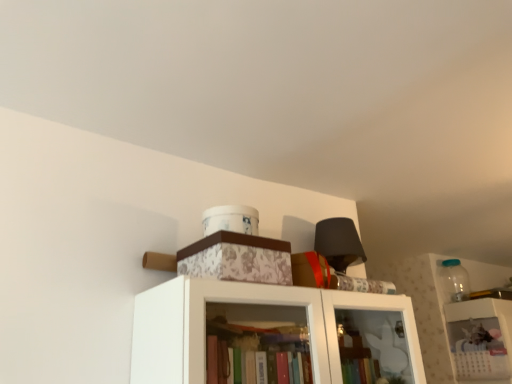
Question: Is white paper calendar at upper right with floral-patterned cardboard box at upper center?

Choices:
 (A) no
 (B) yes

Answer: (A)

Question: Considering the relative sizes of white paper calendar at upper right and floral-patterned cardboard box at upper center in the image provided, is white paper calendar at upper right wider than floral-patterned cardboard box at upper center?

Choices:
 (A) no
 (B) yes

Answer: (B)

Question: Is white paper calendar at upper right at the left side of floral-patterned cardboard box at upper center?

Choices:
 (A) no
 (B) yes

Answer: (A)

Question: From a real-world perspective, is white paper calendar at upper right below floral-patterned cardboard box at upper center?

Choices:
 (A) yes
 (B) no

Answer: (A)

Question: Can you confirm if white paper calendar at upper right is positioned to the right of floral-patterned cardboard box at upper center?

Choices:
 (A) no
 (B) yes

Answer: (B)

Question: Is white paper calendar at upper right wider or thinner than transparent glass jar at upper right?

Choices:
 (A) wide
 (B) thin

Answer: (A)

Question: Considering the positions of white paper calendar at upper right and transparent glass jar at upper right in the image, is white paper calendar at upper right bigger or smaller than transparent glass jar at upper right?

Choices:
 (A) big
 (B) small

Answer: (A)

Question: In the image, is white paper calendar at upper right positioned in front of or behind transparent glass jar at upper right?

Choices:
 (A) behind
 (B) front

Answer: (B)

Question: Is point pos(483,345) closer or farther from the camera than point pos(460,271)?

Choices:
 (A) farther
 (B) closer

Answer: (B)

Question: In terms of size, does white paper calendar at upper right appear bigger or smaller than floral-patterned cardboard box at upper center?

Choices:
 (A) big
 (B) small

Answer: (A)

Question: Is white paper calendar at upper right to the left or to the right of floral-patterned cardboard box at upper center in the image?

Choices:
 (A) left
 (B) right

Answer: (B)

Question: In terms of width, does white paper calendar at upper right look wider or thinner when compared to floral-patterned cardboard box at upper center?

Choices:
 (A) wide
 (B) thin

Answer: (A)

Question: From a real-world perspective, is white paper calendar at upper right above or below floral-patterned cardboard box at upper center?

Choices:
 (A) below
 (B) above

Answer: (A)

Question: Is transparent glass jar at upper right inside the boundaries of floral-patterned cardboard box at upper center, or outside?

Choices:
 (A) outside
 (B) inside

Answer: (A)

Question: In the image, is transparent glass jar at upper right on the left side or the right side of floral-patterned cardboard box at upper center?

Choices:
 (A) left
 (B) right

Answer: (B)